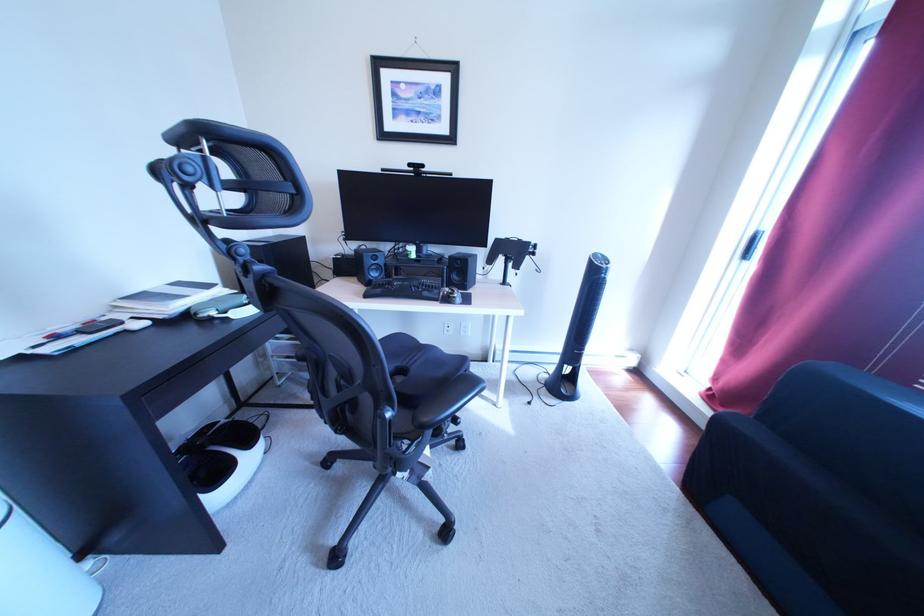
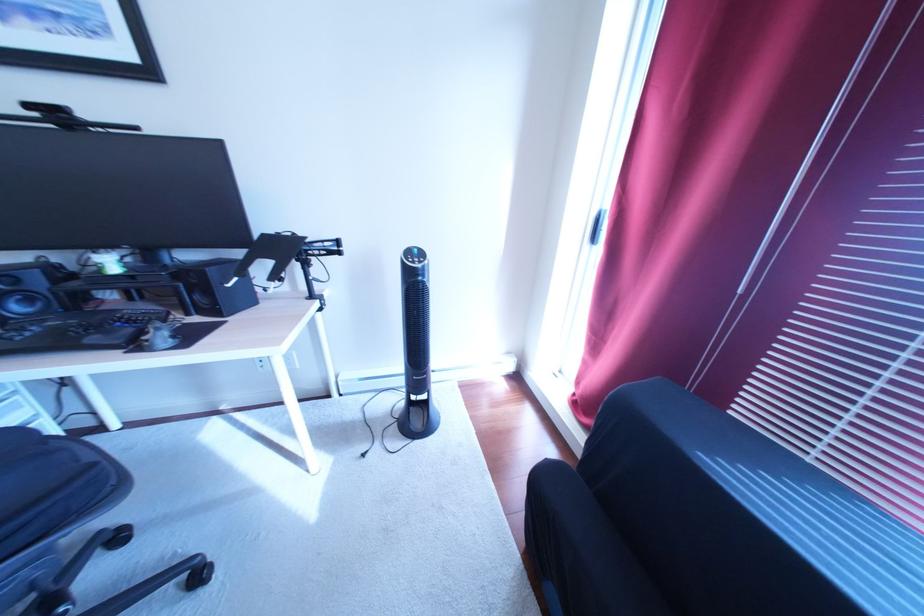
In a continuous first-person perspective shot, in which direction is the camera moving?

The cameraman moved toward right, forward.